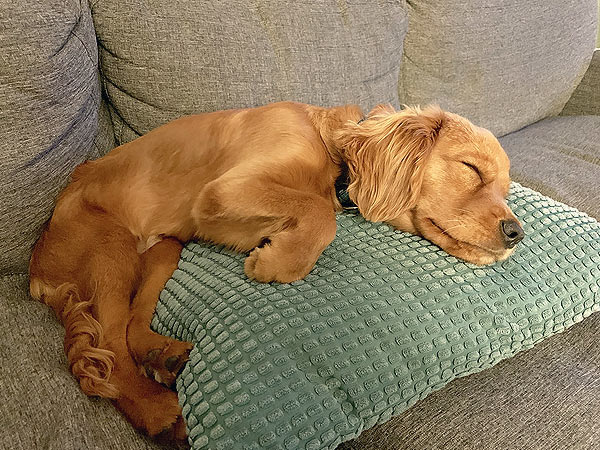
Where is `couch`? The height and width of the screenshot is (450, 600). couch is located at coordinates (53, 356).